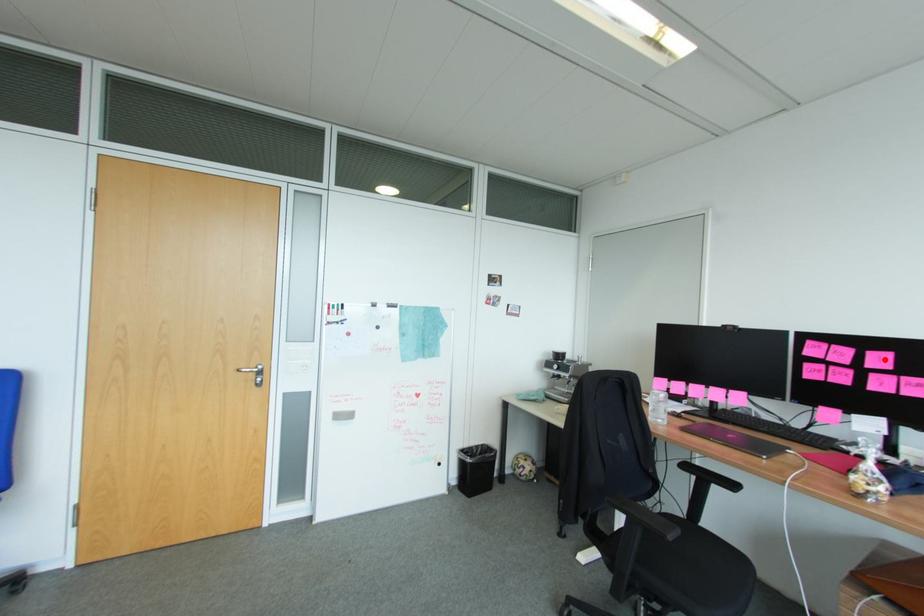
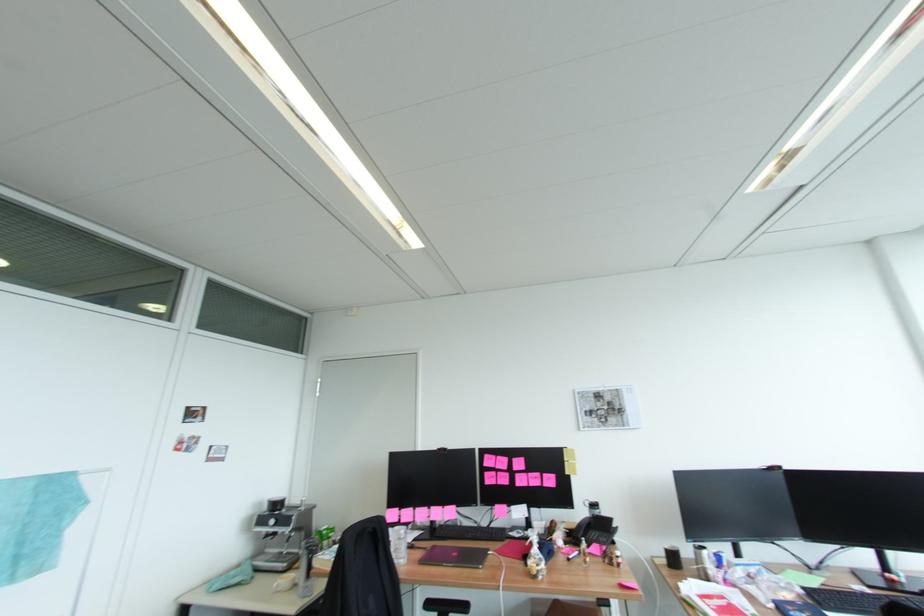
In the second image, find the point that corresponds to the highlighted location in the first image.

(524, 463)